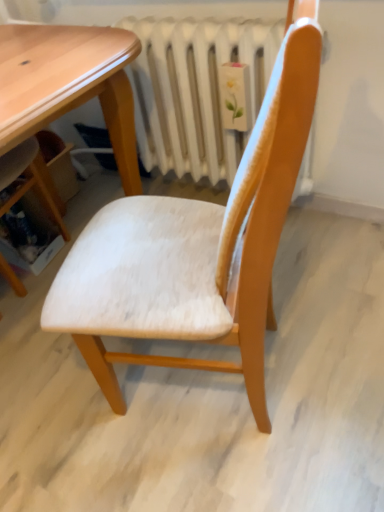
Question: From a real-world perspective, is white fabric chair at center physically located above or below white painted metal radiator at center?

Choices:
 (A) below
 (B) above

Answer: (B)

Question: Is white fabric chair at center inside the boundaries of white painted metal radiator at center, or outside?

Choices:
 (A) inside
 (B) outside

Answer: (B)

Question: In the image, is white fabric chair at center positioned in front of or behind white painted metal radiator at center?

Choices:
 (A) front
 (B) behind

Answer: (A)

Question: Is white painted metal radiator at center bigger or smaller than white fabric chair at center?

Choices:
 (A) small
 (B) big

Answer: (A)

Question: Considering the positions of white painted metal radiator at center and white fabric chair at center in the image, is white painted metal radiator at center wider or thinner than white fabric chair at center?

Choices:
 (A) wide
 (B) thin

Answer: (B)

Question: Considering the positions of white painted metal radiator at center and white fabric chair at center in the image, is white painted metal radiator at center taller or shorter than white fabric chair at center?

Choices:
 (A) tall
 (B) short

Answer: (B)

Question: From a real-world perspective, is white painted metal radiator at center physically located above or below white fabric chair at center?

Choices:
 (A) below
 (B) above

Answer: (A)